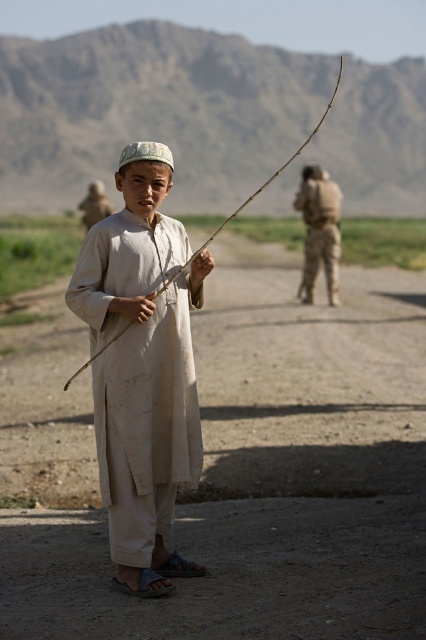
Question: Among these objects, which one is nearest to the camera?

Choices:
 (A) camouflage fabric uniform at right
 (B) beige cotton robe at center
 (C) smooth wooden stick at center

Answer: (C)

Question: From the image, what is the correct spatial relationship of camouflage fabric uniform at right in relation to smooth wooden stick at center?

Choices:
 (A) right
 (B) left

Answer: (A)

Question: Which point is farther to the camera?

Choices:
 (A) (169, 292)
 (B) (319, 129)
 (C) (330, 292)
 (D) (245, 248)

Answer: (D)

Question: Which point is closer to the camera taking this photo?

Choices:
 (A) pyautogui.click(x=227, y=618)
 (B) pyautogui.click(x=313, y=278)
 (C) pyautogui.click(x=342, y=61)

Answer: (A)

Question: Does dirt track at center appear under beige cotton robe at center?

Choices:
 (A) yes
 (B) no

Answer: (B)

Question: Is beige cotton robe at center to the right of smooth wooden stick at center from the viewer's perspective?

Choices:
 (A) yes
 (B) no

Answer: (B)